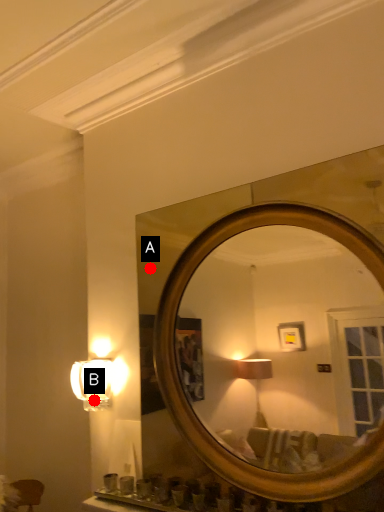
Question: Two points are circled on the image, labeled by A and B beside each circle. Among these points, which one is farthest from the camera?

Choices:
 (A) A is further
 (B) B is further

Answer: (B)